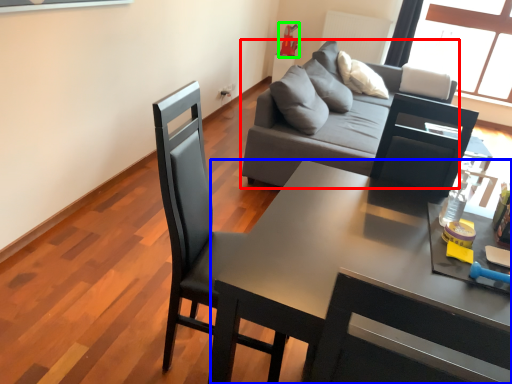
Question: Based on their relative distances, which object is farther from studio couch (highlighted by a red box)? Choose from desk (highlighted by a blue box) and toy (highlighted by a green box).

Choices:
 (A) desk
 (B) toy

Answer: (B)